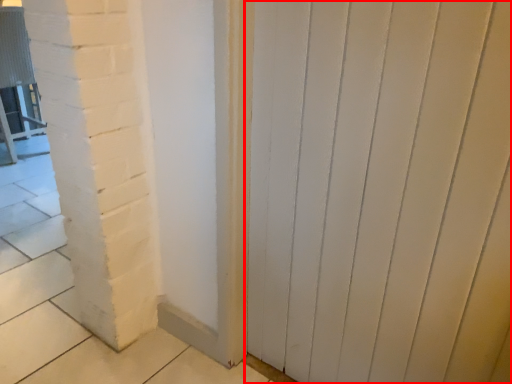
Question: In this image, where is door (annotated by the red box) located relative to chair?

Choices:
 (A) left
 (B) right

Answer: (B)